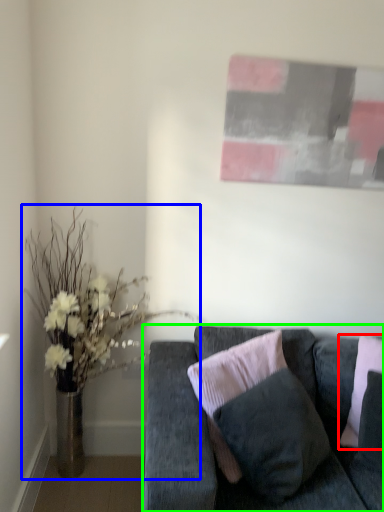
Question: Estimate the real-world distances between objects in this image. Which object is farther from pillow (highlighted by a red box), houseplant (highlighted by a blue box) or studio couch (highlighted by a green box)?

Choices:
 (A) houseplant
 (B) studio couch

Answer: (A)